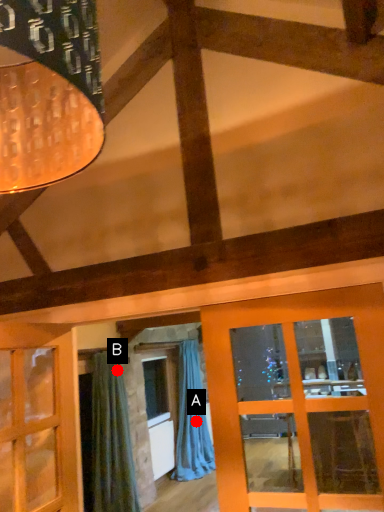
Question: Two points are circled on the image, labeled by A and B beside each circle. Which point is farther to the camera?

Choices:
 (A) A is further
 (B) B is further

Answer: (A)